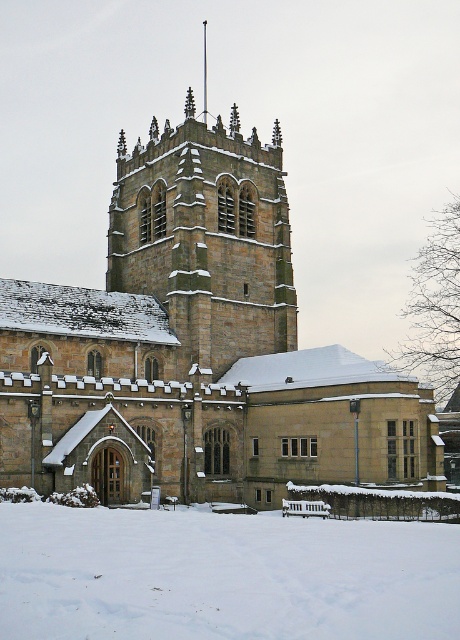
You are standing in front of the historic stone church and notice two points marked on the tower. The first point is at coordinates point (265, 564) and the second is at point (277, 260). Which point is nearer to your current position?

Point (265, 564) is closer to the camera than point (277, 260), so the first point is nearer to your current position.

You are standing at the entrance of the historic stone church and want to walk towards the brown stone tower at center. However, there is white powdery snow at lower center in your path. Can you walk directly to the tower without stepping on the snow?

The white powdery snow at lower center is in front of the brown stone tower at center, so you cannot walk directly to the tower without stepping on the snow.

You are a photographer planning to capture the historic stone church during winter. You want to highlight both the white powdery snow at lower center and the brown stone tower at center in your shot. Based on their sizes, which one would occupy more space in the photo?

The white powdery snow at lower center would occupy more space in the photo since its width is larger than the brown stone tower at center.